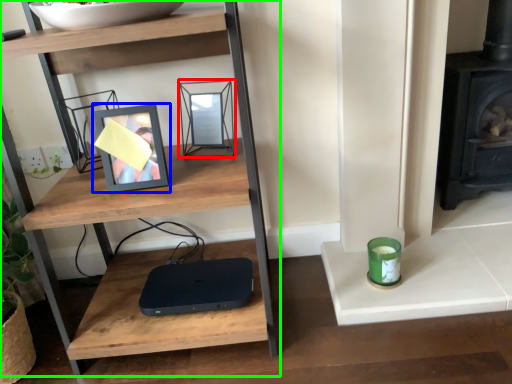
Question: Estimate the real-world distances between objects in this image. Which object is farther from picture frame (highlighted by a red box), picture frame (highlighted by a blue box) or shelf (highlighted by a green box)?

Choices:
 (A) picture frame
 (B) shelf

Answer: (B)